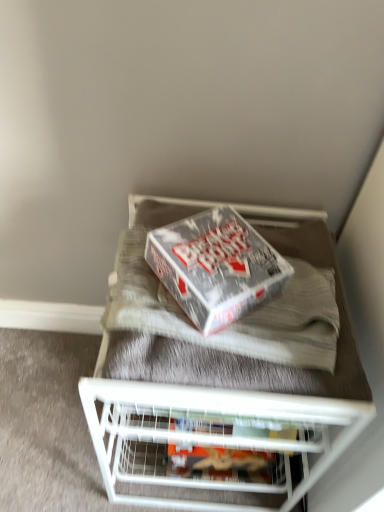
The height and width of the screenshot is (512, 384). Identify the location of vacant region above white metal shelf at upper center (from a real-world perspective). (250, 316).